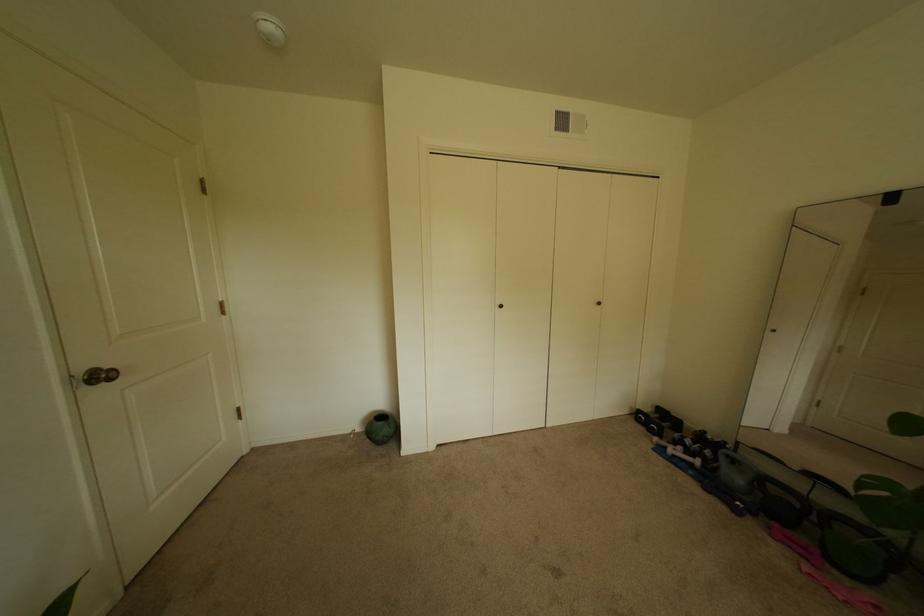
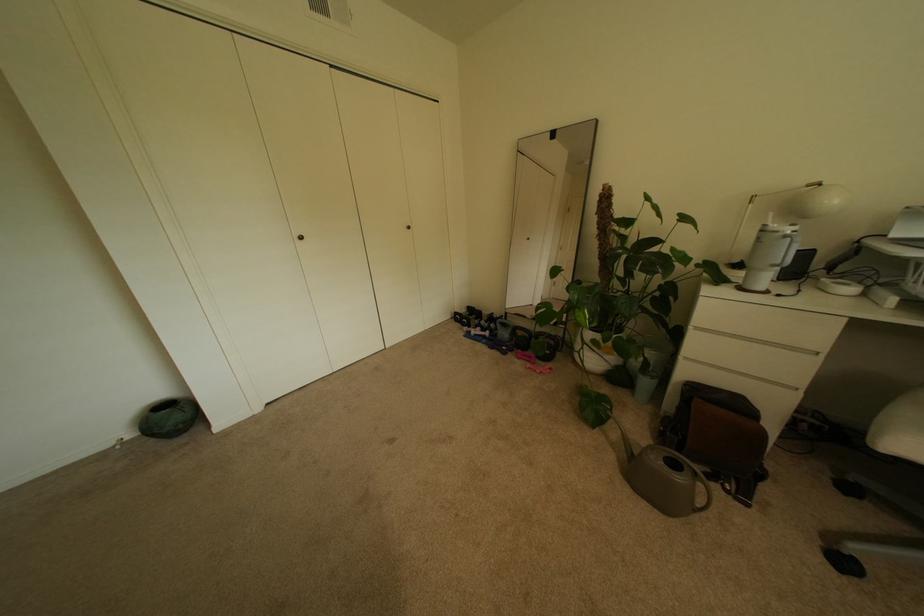
Question: The camera is either moving clockwise (left) or counter-clockwise (right) around the object. The first image is from the beginning of the video and the second image is from the end. Is the camera moving left or right when shooting the video?

Choices:
 (A) Left
 (B) Right

Answer: (A)